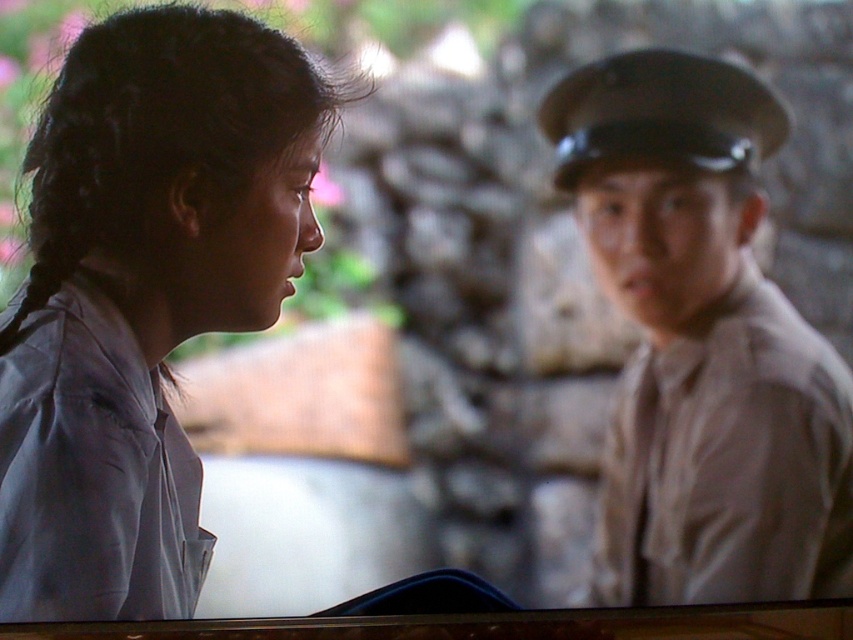
Question: Which of the following is the closest to the observer?

Choices:
 (A) matte gray shirt at left
 (B) light brown uniform at right

Answer: (A)

Question: Is matte gray shirt at left in front of matte gray uniform at left?

Choices:
 (A) no
 (B) yes

Answer: (B)

Question: Among these objects, which one is nearest to the camera?

Choices:
 (A) matte gray uniform at left
 (B) light brown uniform at right

Answer: (A)

Question: Among these points, which one is nearest to the camera?

Choices:
 (A) (230, 250)
 (B) (804, 397)

Answer: (B)

Question: Is matte gray shirt at left positioned at the back of light brown uniform at right?

Choices:
 (A) no
 (B) yes

Answer: (A)

Question: Does matte gray shirt at left have a lesser width compared to matte gray uniform at left?

Choices:
 (A) yes
 (B) no

Answer: (B)